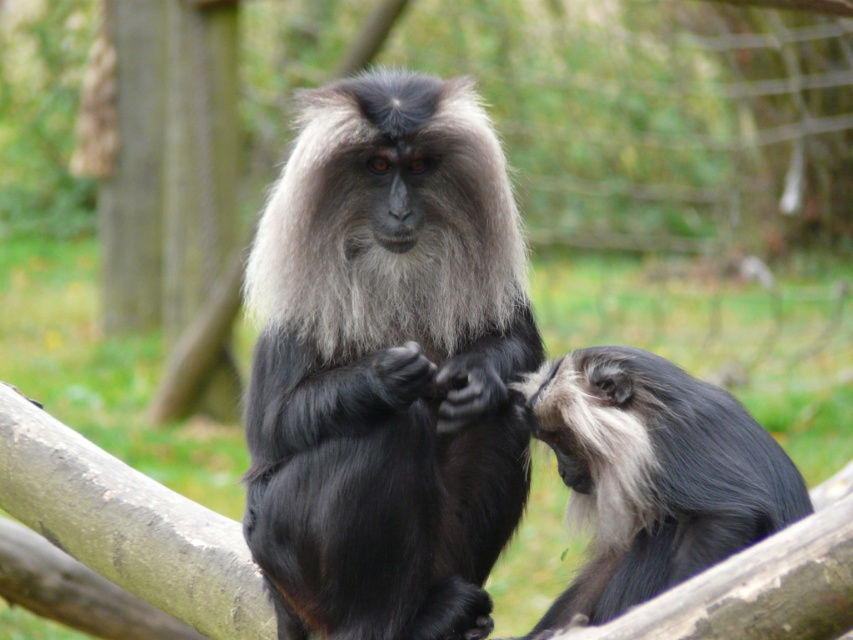
Question: Where is black fur monkey at center located in relation to gray fur monkey at right in the image?

Choices:
 (A) right
 (B) left

Answer: (B)

Question: Which point is farther to the camera?

Choices:
 (A) gray fur monkey at right
 (B) black fur monkey at center

Answer: (B)

Question: Is black fur monkey at center further to the viewer compared to gray fur monkey at right?

Choices:
 (A) yes
 (B) no

Answer: (A)

Question: From the image, what is the correct spatial relationship of black fur monkey at center in relation to gray fur monkey at right?

Choices:
 (A) left
 (B) right

Answer: (A)

Question: Which point appears closest to the camera in this image?

Choices:
 (A) (431, 595)
 (B) (590, 531)

Answer: (B)

Question: Which point is farther to the camera?

Choices:
 (A) (502, 326)
 (B) (798, 472)

Answer: (A)